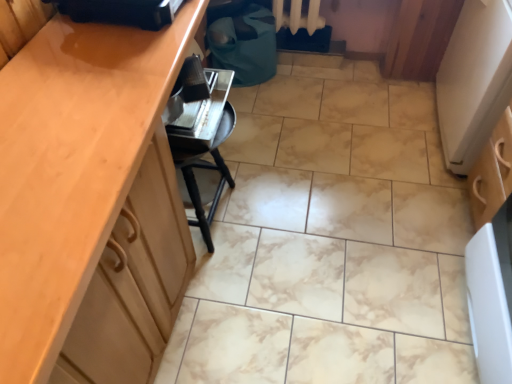
This screenshot has height=384, width=512. What do you see at coordinates (298, 16) in the screenshot?
I see `white textured radiator at upper center` at bounding box center [298, 16].

Image resolution: width=512 pixels, height=384 pixels. Find the location of `white textured radiator at upper center`. white textured radiator at upper center is located at coordinates (298, 16).

This screenshot has height=384, width=512. What do you see at coordinates (121, 11) in the screenshot? I see `black plastic bag at upper center, acting as the second appliance starting from the back` at bounding box center [121, 11].

You are a GUI agent. You are given a task and a screenshot of the screen. Output one action in this format:
    pyautogui.click(x=<x>, y=<y>)
    Task: Click on the metallic silver toaster at lower center, the 2th appliance when ordered from front to back
    
    Given the screenshot: What is the action you would take?
    pyautogui.click(x=197, y=107)

Identify the location of matte wood cabinet at left. The height and width of the screenshot is (384, 512). (90, 203).

Find the location of a particular element. white textured radiator at upper center is located at coordinates (298, 16).

From a real-world perspective, is metallic silver toaster at lower center, the 2th appliance when ordered from front to back, located higher than white textured radiator at upper center?

Yes, from a real-world perspective, metallic silver toaster at lower center, the 2th appliance when ordered from front to back, is on top of white textured radiator at upper center.

Image resolution: width=512 pixels, height=384 pixels. Identify the location of the 2nd appliance below the white textured radiator at upper center (from the image's perspective). (x=197, y=107).

In the image, is metallic silver toaster at lower center, the first appliance viewed from the back, positioned in front of or behind white textured radiator at upper center?

metallic silver toaster at lower center, the first appliance viewed from the back, is in front of white textured radiator at upper center.

Is metallic silver toaster at lower center, the 2th appliance when ordered from front to back, taller than white textured radiator at upper center?

No, metallic silver toaster at lower center, the 2th appliance when ordered from front to back, is not taller than white textured radiator at upper center.

Considering the relative sizes of white textured radiator at upper center and matte wood cabinet at left in the image provided, is white textured radiator at upper center taller than matte wood cabinet at left?

In fact, white textured radiator at upper center may be shorter than matte wood cabinet at left.

In the image, is white textured radiator at upper center on the left side or the right side of matte wood cabinet at left?

From the image, it's evident that white textured radiator at upper center is to the right of matte wood cabinet at left.

Is white textured radiator at upper center oriented away from matte wood cabinet at left?

Answer: No, white textured radiator at upper center is not facing the opposite direction of matte wood cabinet at left.

The width and height of the screenshot is (512, 384). I want to click on cabinetry above the white textured radiator at upper center (from a real-world perspective), so click(90, 203).

Image resolution: width=512 pixels, height=384 pixels. What are the coordinates of `the 1st appliance behind the matte wood cabinet at left, counting from the anchor's position` in the screenshot? It's located at (121, 11).

Considering the sizes of objects black plastic bag at upper center, the 1th appliance when ordered from front to back, and matte wood cabinet at left in the image provided, who is taller, black plastic bag at upper center, the 1th appliance when ordered from front to back, or matte wood cabinet at left?

matte wood cabinet at left is taller.

Who is smaller, black plastic bag at upper center, the 1th appliance when ordered from front to back, or matte wood cabinet at left?

With smaller size is black plastic bag at upper center, the 1th appliance when ordered from front to back.

Can you tell me how much black plastic bag at upper center, the 1th appliance when ordered from front to back, and matte wood cabinet at left differ in facing direction?

They differ by 0.71 degrees in their facing directions.

Considering the sizes of objects black plastic bag at upper center, acting as the second appliance starting from the back, and white textured radiator at upper center in the image provided, who is wider, black plastic bag at upper center, acting as the second appliance starting from the back, or white textured radiator at upper center?

black plastic bag at upper center, acting as the second appliance starting from the back.

Are black plastic bag at upper center, the 1th appliance when ordered from front to back, and white textured radiator at upper center making contact?

No, black plastic bag at upper center, the 1th appliance when ordered from front to back, is not next to white textured radiator at upper center.

From the image's perspective, would you say black plastic bag at upper center, the 1th appliance when ordered from front to back, is positioned over white textured radiator at upper center?

Actually, black plastic bag at upper center, the 1th appliance when ordered from front to back, appears below white textured radiator at upper center in the image.

Who is smaller, black plastic bag at upper center, the 1th appliance when ordered from front to back, or white textured radiator at upper center?

With smaller size is black plastic bag at upper center, the 1th appliance when ordered from front to back.

Is matte wood cabinet at left next to black plastic bag at upper center, acting as the second appliance starting from the back, and touching it?

matte wood cabinet at left and black plastic bag at upper center, acting as the second appliance starting from the back, are clearly separated.

Based on the photo, who is bigger, matte wood cabinet at left or black plastic bag at upper center, acting as the second appliance starting from the back?

matte wood cabinet at left is bigger.

Consider the image. Is matte wood cabinet at left looking in the opposite direction of black plastic bag at upper center, acting as the second appliance starting from the back?

matte wood cabinet at left is not turned away from black plastic bag at upper center, acting as the second appliance starting from the back.

Is point (135, 126) behind point (97, 20)?

No, it is in front of (97, 20).

Considering the positions of point (205, 92) and point (128, 23), is point (205, 92) closer or farther from the camera than point (128, 23)?

Point (205, 92) appears to be farther away from the viewer than point (128, 23).

From a real-world perspective, is metallic silver toaster at lower center, the 2th appliance when ordered from front to back, below black plastic bag at upper center, acting as the second appliance starting from the back?

Yes.

Is there a large distance between metallic silver toaster at lower center, the 2th appliance when ordered from front to back, and black plastic bag at upper center, the 1th appliance when ordered from front to back?

No, metallic silver toaster at lower center, the 2th appliance when ordered from front to back, is in close proximity to black plastic bag at upper center, the 1th appliance when ordered from front to back.

Considering the positions of objects metallic silver toaster at lower center, the first appliance viewed from the back, and black plastic bag at upper center, the 1th appliance when ordered from front to back, in the image provided, who is more to the left, metallic silver toaster at lower center, the first appliance viewed from the back, or black plastic bag at upper center, the 1th appliance when ordered from front to back,?

From the viewer's perspective, black plastic bag at upper center, the 1th appliance when ordered from front to back, appears more on the left side.

From the image's perspective, which is above, white textured radiator at upper center or black plastic bag at upper center, acting as the second appliance starting from the back?

white textured radiator at upper center.

Is white textured radiator at upper center in contact with black plastic bag at upper center, the 1th appliance when ordered from front to back?

No, white textured radiator at upper center is not with black plastic bag at upper center, the 1th appliance when ordered from front to back.

Considering the positions of objects white textured radiator at upper center and black plastic bag at upper center, acting as the second appliance starting from the back, in the image provided, who is behind, white textured radiator at upper center or black plastic bag at upper center, acting as the second appliance starting from the back,?

white textured radiator at upper center is behind.

Which is more to the left, white textured radiator at upper center or black plastic bag at upper center, acting as the second appliance starting from the back?

From the viewer's perspective, black plastic bag at upper center, acting as the second appliance starting from the back, appears more on the left side.

Find the location of a particular element. the 2nd appliance below when counting from the white textured radiator at upper center (from the image's perspective) is located at coordinates (197, 107).

This screenshot has width=512, height=384. In order to click on radiator lying on the right of matte wood cabinet at left in this screenshot , I will do `click(298, 16)`.

Estimate the real-world distances between objects in this image. Which object is further from matte wood cabinet at left, metallic silver toaster at lower center, the first appliance viewed from the back, or black plastic bag at upper center, the 1th appliance when ordered from front to back?

black plastic bag at upper center, the 1th appliance when ordered from front to back, is further to matte wood cabinet at left.

From the image, which object appears to be nearer to white textured radiator at upper center, metallic silver toaster at lower center, the first appliance viewed from the back, or matte wood cabinet at left?

Based on the image, metallic silver toaster at lower center, the first appliance viewed from the back, appears to be nearer to white textured radiator at upper center.

When comparing their distances from white textured radiator at upper center, does metallic silver toaster at lower center, the first appliance viewed from the back, or black plastic bag at upper center, acting as the second appliance starting from the back, seem closer?

metallic silver toaster at lower center, the first appliance viewed from the back.

Which object lies nearer to the anchor point black plastic bag at upper center, acting as the second appliance starting from the back, matte wood cabinet at left or metallic silver toaster at lower center, the first appliance viewed from the back?

metallic silver toaster at lower center, the first appliance viewed from the back.

Estimate the real-world distances between objects in this image. Which object is closer to matte wood cabinet at left, black plastic bag at upper center, acting as the second appliance starting from the back, or metallic silver toaster at lower center, the 2th appliance when ordered from front to back?

Based on the image, metallic silver toaster at lower center, the 2th appliance when ordered from front to back, appears to be nearer to matte wood cabinet at left.

Looking at the image, which one is located closer to metallic silver toaster at lower center, the first appliance viewed from the back, black plastic bag at upper center, acting as the second appliance starting from the back, or white textured radiator at upper center?

black plastic bag at upper center, acting as the second appliance starting from the back.

Considering their positions, is black plastic bag at upper center, the 1th appliance when ordered from front to back, positioned closer to matte wood cabinet at left than white textured radiator at upper center?

black plastic bag at upper center, the 1th appliance when ordered from front to back.

Estimate the real-world distances between objects in this image. Which object is closer to black plastic bag at upper center, the 1th appliance when ordered from front to back, metallic silver toaster at lower center, the first appliance viewed from the back, or matte wood cabinet at left?

Based on the image, metallic silver toaster at lower center, the first appliance viewed from the back, appears to be nearer to black plastic bag at upper center, the 1th appliance when ordered from front to back.

Locate an element on the screen. The image size is (512, 384). appliance positioned between matte wood cabinet at left and metallic silver toaster at lower center, the 2th appliance when ordered from front to back, from near to far is located at coordinates (121, 11).

Where is `appliance located between black plastic bag at upper center, the 1th appliance when ordered from front to back, and white textured radiator at upper center in the depth direction`? appliance located between black plastic bag at upper center, the 1th appliance when ordered from front to back, and white textured radiator at upper center in the depth direction is located at coordinates (197, 107).